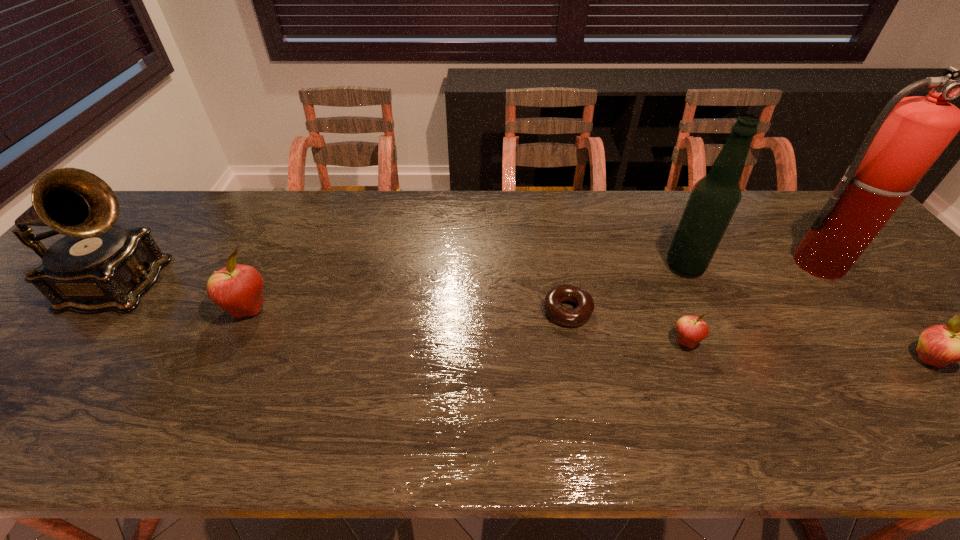
At what (x,y) coordinates should I click in order to perform the action: click on object that is the fourth closest to the alcohol. Please return your answer as a coordinate pair (x, y). Looking at the image, I should click on (959, 341).

Point out which object is positioned as the fourth nearest to the rightmost apple. Please provide its 2D coordinates. Your answer should be formatted as a tuple, i.e. [(x, y)], where the tuple contains the x and y coordinates of a point satisfying the conditions above.

[(553, 299)]

Select which apple is the closest to the alcohol. Please provide its 2D coordinates. Your answer should be formatted as a tuple, i.e. [(x, y)], where the tuple contains the x and y coordinates of a point satisfying the conditions above.

[(691, 330)]

The image size is (960, 540). In order to click on the closest apple to the alcohol in this screenshot , I will do `click(691, 330)`.

This screenshot has height=540, width=960. Find the location of `free location that satisfies the following two spatial constraints: 1. on the horn of the phonograph record; 2. on the right side of the fourth tallest object`. free location that satisfies the following two spatial constraints: 1. on the horn of the phonograph record; 2. on the right side of the fourth tallest object is located at coordinates (98, 310).

Locate an element on the screen. Image resolution: width=960 pixels, height=540 pixels. free space that satisfies the following two spatial constraints: 1. on the horn of the fifth shortest object; 2. on the left side of the second shortest object is located at coordinates (72, 341).

You are a GUI agent. You are given a task and a screenshot of the screen. Output one action in this format:
    pyautogui.click(x=<x>, y=<y>)
    Task: Click on the vacant space that satisfies the following two spatial constraints: 1. with the nozzle and gauge on the fire extinguisher; 2. on the horn of the phonograph record
    The image size is (960, 540).
    Given the screenshot: What is the action you would take?
    pyautogui.click(x=840, y=286)

At what (x,y) coordinates should I click in order to perform the action: click on free space that satisfies the following two spatial constraints: 1. on the horn of the fifth object from right to left; 2. on the right side of the phonograph record. Please return your answer as a coordinate pair (x, y). Looking at the image, I should click on (97, 310).

At what (x,y) coordinates should I click in order to perform the action: click on vacant space that satisfies the following two spatial constraints: 1. on the front side of the third object from left to right; 2. on the right side of the farthest apple. Please return your answer as a coordinate pair (x, y). The image size is (960, 540). Looking at the image, I should click on (248, 310).

Image resolution: width=960 pixels, height=540 pixels. In order to click on vacant space that satisfies the following two spatial constraints: 1. on the horn of the third tallest object; 2. on the left side of the second apple from right to left in this screenshot , I will do `click(72, 341)`.